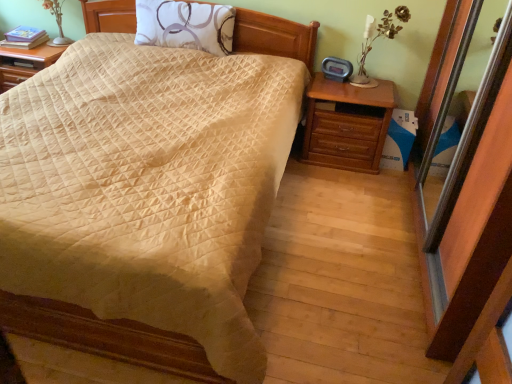
Question: In terms of width, does white ceramic table lamp at upper right, placed as the second table lamp when sorted from back to front, look wider or thinner when compared to white fabric pillow at upper center?

Choices:
 (A) thin
 (B) wide

Answer: (A)

Question: From a real-world perspective, is white ceramic table lamp at upper right, which ranks as the 1th table lamp in bottom-to-top order, physically located above or below white fabric pillow at upper center?

Choices:
 (A) below
 (B) above

Answer: (A)

Question: Which is nearer to the white fabric pillow at upper center?

Choices:
 (A) beige quilted bed at center
 (B) matte silver table lamp at upper left, which appears as the first table lamp when viewed from the left
 (C) white ceramic table lamp at upper right, which ranks as the 1th table lamp in bottom-to-top order

Answer: (B)

Question: Which is nearer to the white ceramic table lamp at upper right, placed as the second table lamp when sorted from back to front?

Choices:
 (A) matte silver table lamp at upper left, which appears as the second table lamp when viewed from the right
 (B) white fabric pillow at upper center
 (C) beige quilted bed at center

Answer: (B)